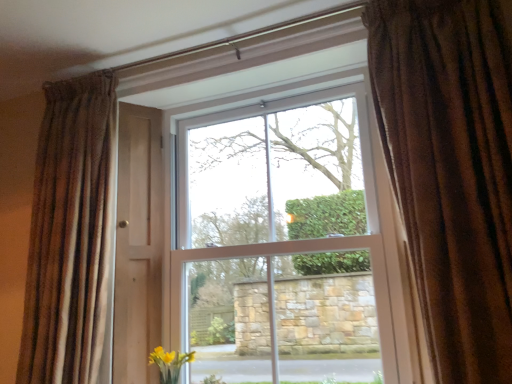
Question: Considering the relative sizes of brown textured curtain at left, which is counted as the first curtain, starting from the back, and white plastic window at center in the image provided, is brown textured curtain at left, which is counted as the first curtain, starting from the back, taller than white plastic window at center?

Choices:
 (A) no
 (B) yes

Answer: (A)

Question: From a real-world perspective, is brown textured curtain at left, marked as the second curtain in a front-to-back arrangement, located beneath white plastic window at center?

Choices:
 (A) yes
 (B) no

Answer: (B)

Question: Is brown textured curtain at left, which is counted as the first curtain, starting from the back, positioned behind white plastic window at center?

Choices:
 (A) yes
 (B) no

Answer: (B)

Question: Can you confirm if brown textured curtain at left, which is counted as the first curtain, starting from the back, is shorter than white plastic window at center?

Choices:
 (A) no
 (B) yes

Answer: (B)

Question: From the image's perspective, is brown textured curtain at left, which is counted as the first curtain, starting from the back, located above white plastic window at center?

Choices:
 (A) no
 (B) yes

Answer: (B)

Question: In the image, is brown textured curtain at right, the 2th curtain when ordered from left to right, positioned in front of or behind white plastic window at center?

Choices:
 (A) front
 (B) behind

Answer: (A)

Question: From the image's perspective, is brown textured curtain at right, the 1th curtain in the right-to-left sequence, located above or below white plastic window at center?

Choices:
 (A) above
 (B) below

Answer: (A)

Question: Looking at the image, does brown textured curtain at right, the 2th curtain in the back-to-front sequence, seem bigger or smaller compared to white plastic window at center?

Choices:
 (A) small
 (B) big

Answer: (A)

Question: Is point (420, 67) positioned closer to the camera than point (400, 362)?

Choices:
 (A) farther
 (B) closer

Answer: (B)

Question: Would you say brown textured curtain at left, marked as the second curtain in a front-to-back arrangement, is inside or outside brown textured curtain at right, the 2th curtain when ordered from left to right?

Choices:
 (A) inside
 (B) outside

Answer: (B)

Question: From a real-world perspective, relative to brown textured curtain at right, which ranks as the 1th curtain in front-to-back order, is brown textured curtain at left, marked as the second curtain in a front-to-back arrangement, vertically above or below?

Choices:
 (A) below
 (B) above

Answer: (A)

Question: Is brown textured curtain at left, which appears as the 2th curtain when viewed from the right, in front of or behind brown textured curtain at right, the 2th curtain in the back-to-front sequence, in the image?

Choices:
 (A) behind
 (B) front

Answer: (A)

Question: In terms of width, does brown textured curtain at left, which is counted as the first curtain, starting from the back, look wider or thinner when compared to brown textured curtain at right, the 2th curtain in the back-to-front sequence?

Choices:
 (A) wide
 (B) thin

Answer: (B)

Question: Considering the positions of white plastic window at center and brown textured curtain at left, marked as the second curtain in a front-to-back arrangement, in the image, is white plastic window at center bigger or smaller than brown textured curtain at left, marked as the second curtain in a front-to-back arrangement,?

Choices:
 (A) big
 (B) small

Answer: (A)

Question: Does point (337, 302) appear closer or farther from the camera than point (32, 268)?

Choices:
 (A) closer
 (B) farther

Answer: (B)